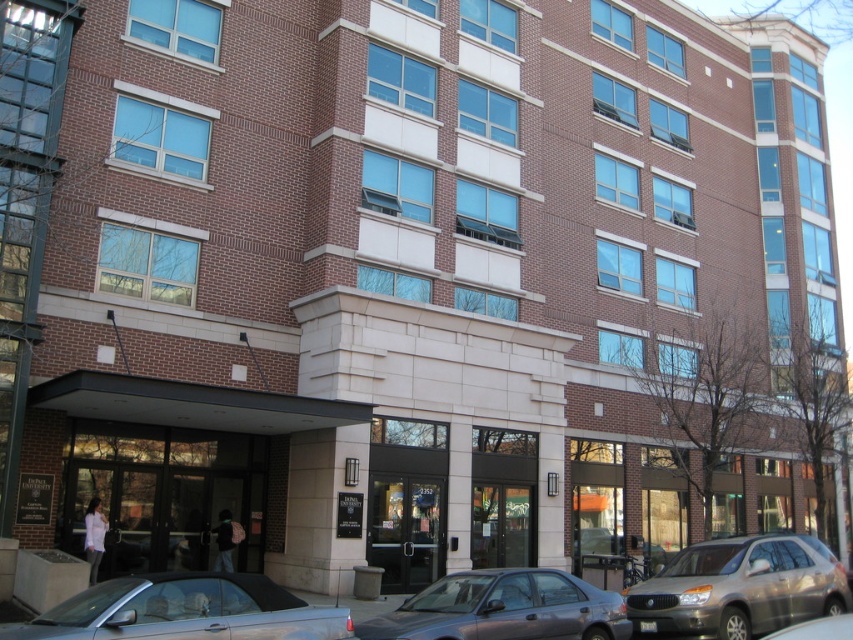
Based on the photo, you are standing at the entrance of the building and want to find the silver metallic convertible at lower left. Based on the coordinates given, in which direction should you look to locate it?

The silver metallic convertible at lower left is located at coordinates point (184, 611), which would be to the lower left direction from your current position at the entrance.